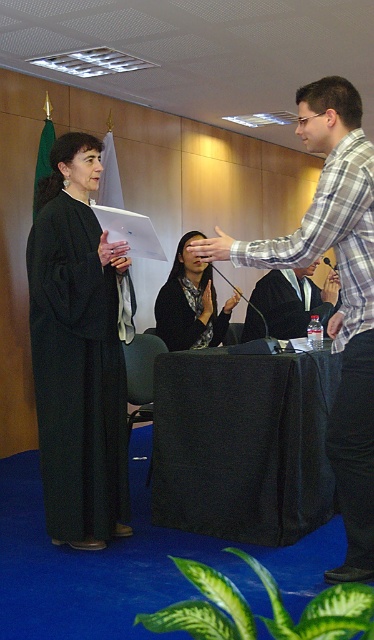
You are a photographer setting up for a formal event. You need to ensure that the black fabric table at center and the black robe at center are visible in your shot. Based on their positions, which object is closer to the camera?

The black robe at center is closer to the camera because it is positioned over the black fabric table at center, which is underneath it.

You are organizing a meeting in this room and need to place a large document on the surface between the black fabric table at center and the black matte robe at center. Which object should you place it on?

The black fabric table at center is bigger than the black matte robe at center, so you should place the large document on the black fabric table at center.